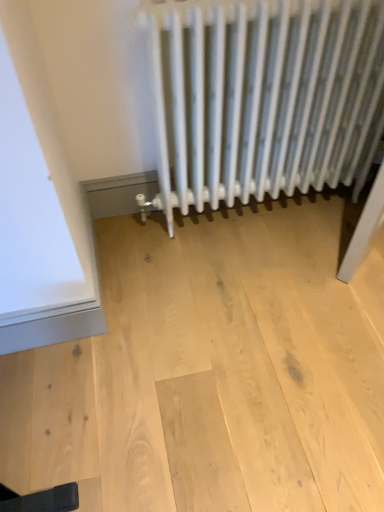
This screenshot has width=384, height=512. Find the location of `white matte radiator at center`. white matte radiator at center is located at coordinates (264, 96).

In order to face white matte radiator at center, should I rotate leftwards or rightwards?

To align with it, rotate right about 8.850°.

What is the approximate width of white matte radiator at center?

The width of white matte radiator at center is 7.38 inches.

Describe the element at coordinates (264, 96) in the screenshot. I see `white matte radiator at center` at that location.

You are a GUI agent. You are given a task and a screenshot of the screen. Output one action in this format:
    pyautogui.click(x=<x>, y=<y>)
    Task: Click on the white matte radiator at center
    Image resolution: width=384 pixels, height=512 pixels.
    Given the screenshot: What is the action you would take?
    pyautogui.click(x=264, y=96)